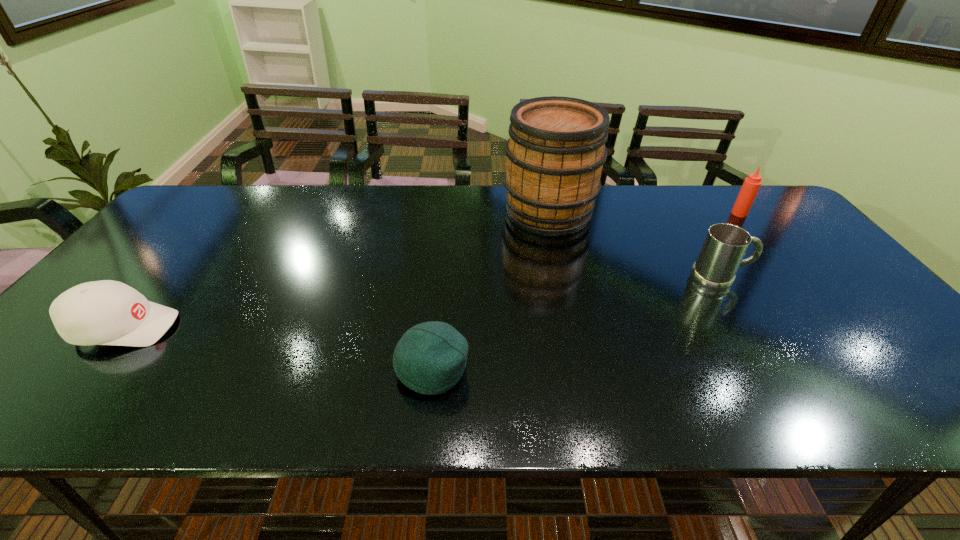
Identify the location of the third object from left to right. The image size is (960, 540). (555, 154).

Find the location of a particular element. the tallest object is located at coordinates pyautogui.click(x=555, y=154).

At what (x,y) coordinates should I click in order to perform the action: click on the rightmost object. Please return your answer as a coordinate pair (x, y). This screenshot has width=960, height=540. Looking at the image, I should click on (751, 185).

The image size is (960, 540). In order to click on the fourth object from left to right in this screenshot , I will do pos(725,245).

This screenshot has height=540, width=960. I want to click on mug, so [x=725, y=245].

This screenshot has width=960, height=540. I want to click on beanie, so click(430, 358).

Identify the location of baseball cap. This screenshot has width=960, height=540. (106, 312).

Identify the location of vacant region located on the left of the cider. (403, 212).

Find the location of a particular element. Image resolution: width=960 pixels, height=540 pixels. vacant space located 0.300m on the left of the rightmost object is located at coordinates (637, 213).

Image resolution: width=960 pixels, height=540 pixels. I want to click on vacant space located 0.220m on the side of the mug with the handle, so click(830, 279).